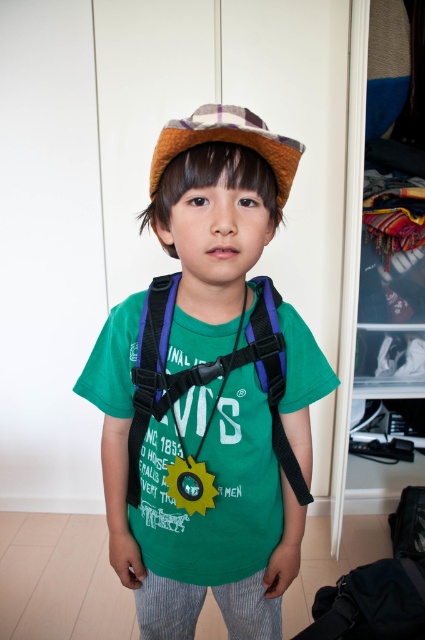
Question: Is green matte t-shirt at center closer to the viewer compared to plaid fabric cowboy hat at upper center?

Choices:
 (A) no
 (B) yes

Answer: (A)

Question: Does purple fabric strap at center appear on the left side of plaid fabric cowboy hat at upper center?

Choices:
 (A) yes
 (B) no

Answer: (B)

Question: Among these points, which one is nearest to the camera?

Choices:
 (A) tap(258, 336)
 (B) tap(240, 145)

Answer: (B)

Question: Considering the real-world distances, which object is farthest from the plaid fabric cowboy hat at upper center?

Choices:
 (A) green matte t-shirt at center
 (B) purple fabric strap at center

Answer: (A)

Question: Considering the real-world distances, which object is closest to the green matte t-shirt at center?

Choices:
 (A) plaid fabric cowboy hat at upper center
 (B) purple fabric strap at center

Answer: (B)

Question: Does purple fabric strap at center have a larger size compared to plaid fabric cowboy hat at upper center?

Choices:
 (A) yes
 (B) no

Answer: (A)